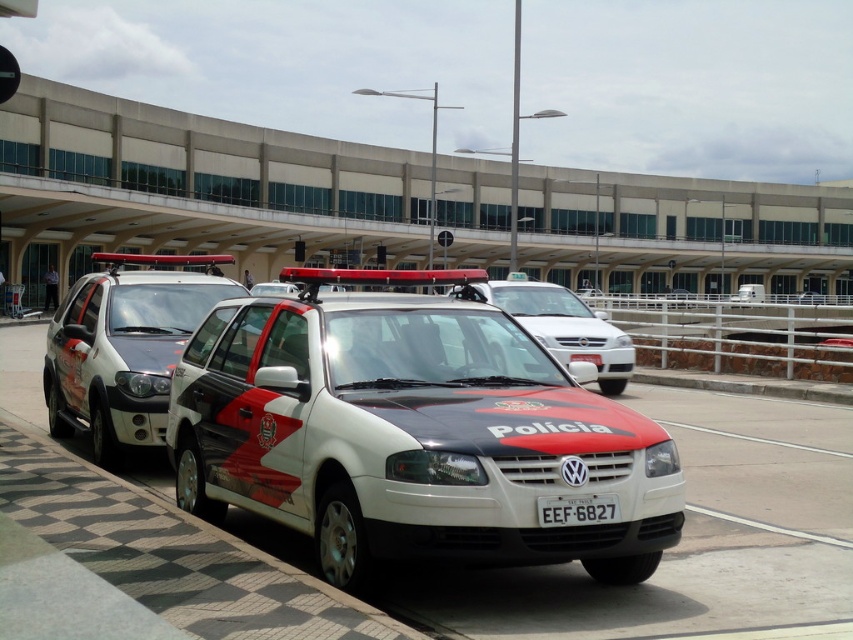
Between point (141, 284) and point (560, 504), which one is positioned behind?

The point (141, 284) is more distant.

Is point (184, 317) less distant than point (566, 518)?

No, it is behind (566, 518).

At what (x,y) coordinates should I click in order to perform the action: click on white matte suv at center. Please return your answer as a coordinate pair (x, y). The width and height of the screenshot is (853, 640). Looking at the image, I should click on (x=125, y=348).

Which is in front, point (653, 557) or point (155, 384)?

Point (653, 557)

Can you confirm if white glossy police car at center is positioned below white matte suv at center?

Yes, white glossy police car at center is below white matte suv at center.

The height and width of the screenshot is (640, 853). What are the coordinates of `white glossy police car at center` in the screenshot? It's located at (410, 433).

Measure the distance from matte black police car at center to white plastic license plate at center.

A distance of 3.56 meters exists between matte black police car at center and white plastic license plate at center.

Does point (573, 344) come closer to viewer compared to point (587, 518)?

No, it is not.

This screenshot has width=853, height=640. I want to click on matte black police car at center, so click(x=566, y=326).